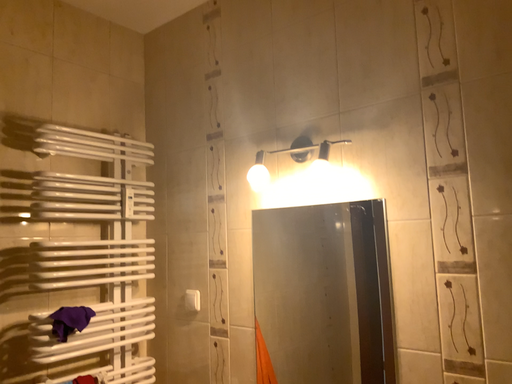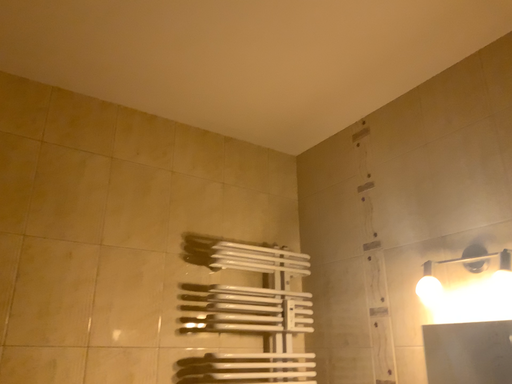
Question: Which way did the camera rotate in the video?

Choices:
 (A) rotated right
 (B) rotated left

Answer: (B)